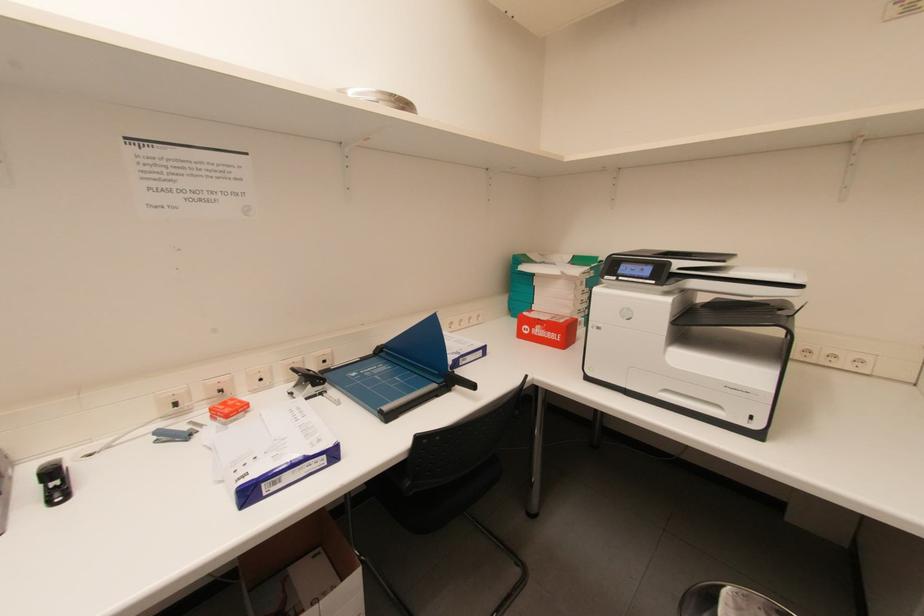
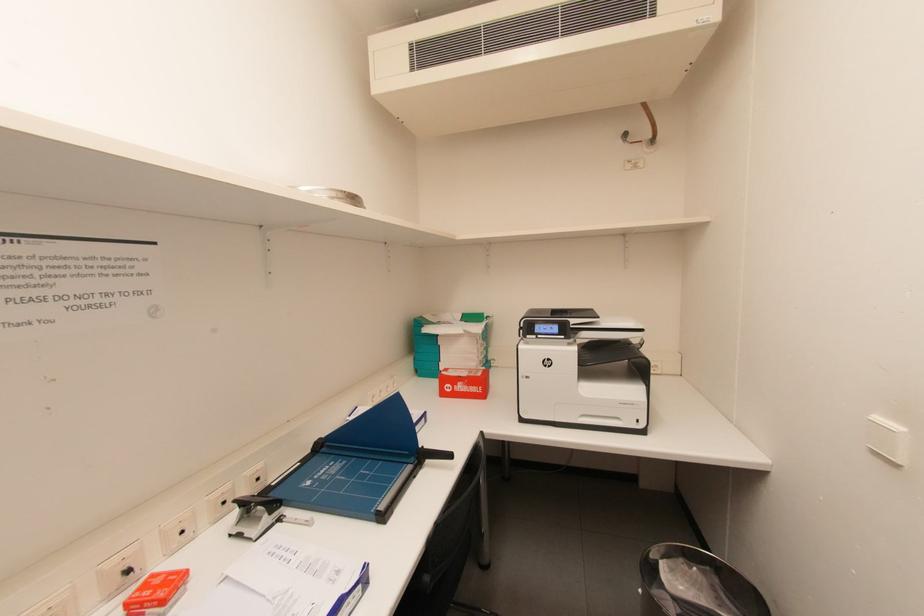
Question: In a continuous first-person perspective shot, in which direction is the camera moving?

Choices:
 (A) Left
 (B) Right
 (C) Forward
 (D) Backward

Answer: (A)